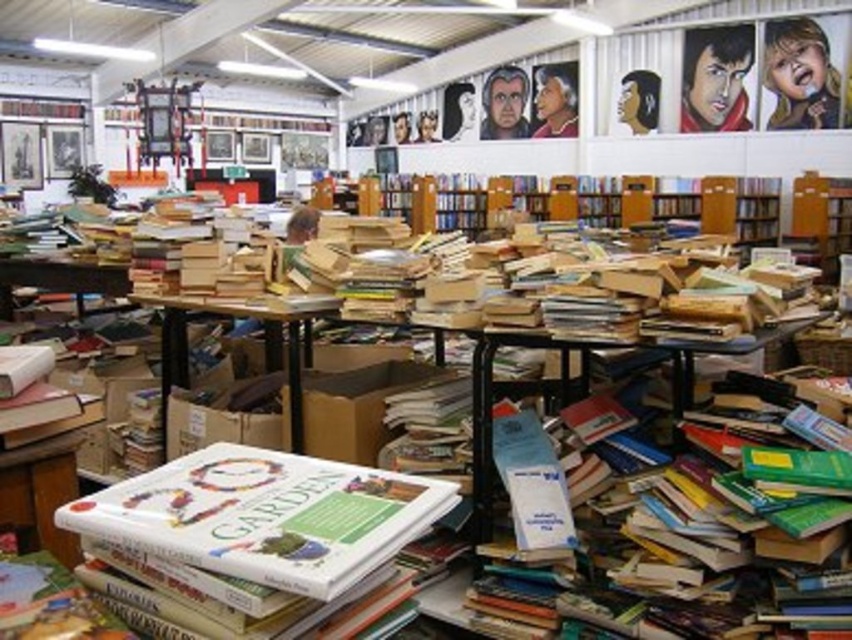
Question: Estimate the real-world distances between objects in this image. Which object is farther from the hardcover books at center?

Choices:
 (A) brown cardboard box at center
 (B) hardcover book at center

Answer: (B)

Question: Does hardcover books at center come behind hardcover book at center?

Choices:
 (A) no
 (B) yes

Answer: (B)

Question: Can you confirm if hardcover books at center is positioned to the left of wooden bookshelf at center?

Choices:
 (A) yes
 (B) no

Answer: (B)

Question: Observing the image, what is the correct spatial positioning of hardcover books at center in reference to hardcover book at center?

Choices:
 (A) above
 (B) below

Answer: (B)

Question: Which point is farther from the camera taking this photo?

Choices:
 (A) (727, 198)
 (B) (142, 304)
 (C) (620, 548)
 (D) (258, 566)

Answer: (A)

Question: Which is farther from the brown cardboard box at center?

Choices:
 (A) hardcover books at center
 (B) hardcover book at center

Answer: (B)